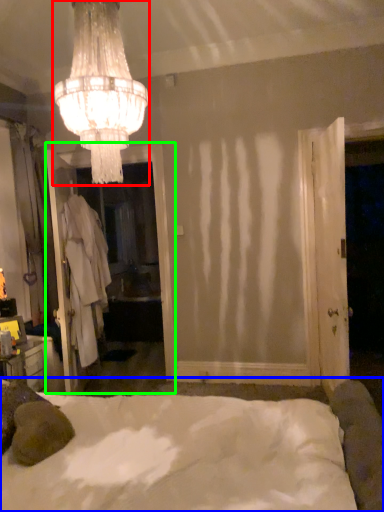
Question: Which object is the farthest from lamp (highlighted by a red box)? Choose among these: bed (highlighted by a blue box) or screen door (highlighted by a green box).

Choices:
 (A) bed
 (B) screen door

Answer: (B)